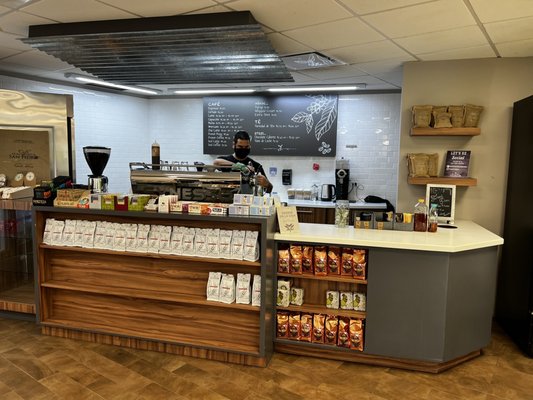
Where is `door`? Image resolution: width=533 pixels, height=400 pixels. door is located at coordinates (29, 154).